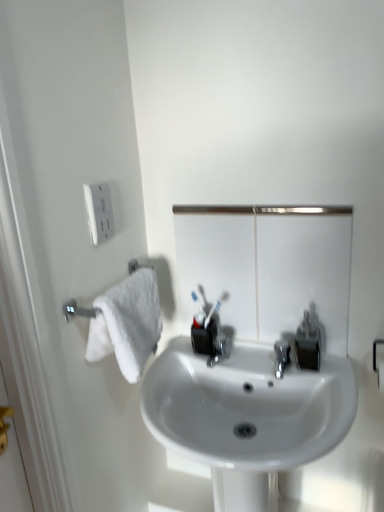
Describe the element at coordinates (247, 416) in the screenshot. I see `white glossy sink at center` at that location.

In order to click on metallic reflective mirror at center in this screenshot , I will do `click(268, 267)`.

Locate an element on the screen. This screenshot has width=384, height=512. white glossy sink at center is located at coordinates (247, 416).

Considering the positions of objects white plastic outlet at upper left and matte black soap dispenser at center right in the image provided, who is more to the left, white plastic outlet at upper left or matte black soap dispenser at center right?

Positioned to the left is white plastic outlet at upper left.

Based on the photo, considering the relative sizes of white plastic outlet at upper left and matte black soap dispenser at center right in the image provided, is white plastic outlet at upper left thinner than matte black soap dispenser at center right?

Correct, the width of white plastic outlet at upper left is less than that of matte black soap dispenser at center right.

From the picture: Is white plastic outlet at upper left behind matte black soap dispenser at center right?

No, it is in front of matte black soap dispenser at center right.

How many degrees apart are the facing directions of white plastic outlet at upper left and matte black soap dispenser at center right?

89.5 degrees separate the facing orientations of white plastic outlet at upper left and matte black soap dispenser at center right.

From the image's perspective, is matte black soap dispenser at center right on white glossy sink at center?

Yes, from the image's perspective, matte black soap dispenser at center right is over white glossy sink at center.

Can you confirm if matte black soap dispenser at center right is smaller than white glossy sink at center?

Yes.

Looking at this image, is white glossy sink at center inside matte black soap dispenser at center right?

No, white glossy sink at center is not inside matte black soap dispenser at center right.

Considering their positions, is matte black soap dispenser at center right located in front of or behind white glossy sink at center?

In the image, matte black soap dispenser at center right appears behind white glossy sink at center.

Who is bigger, metallic reflective mirror at center or matte black soap dispenser at center right?

With larger size is metallic reflective mirror at center.

Looking at this image, which object is further away from the camera, metallic reflective mirror at center or matte black soap dispenser at center right?

matte black soap dispenser at center right is further from the camera.

You are a GUI agent. You are given a task and a screenshot of the screen. Output one action in this format:
    pyautogui.click(x=<x>, y=<y>)
    Task: Click on the plumbing fixture below the metallic reflective mirror at center (from a real-world perspective)
    Image resolution: width=384 pixels, height=512 pixels.
    Given the screenshot: What is the action you would take?
    (308, 345)

How many degrees apart are the facing directions of matte black soap dispenser at center right and white plastic outlet at upper left?

89.5 degrees separate the facing orientations of matte black soap dispenser at center right and white plastic outlet at upper left.

Is matte black soap dispenser at center right to the right of white plastic outlet at upper left from the viewer's perspective?

Yes, matte black soap dispenser at center right is to the right of white plastic outlet at upper left.

Image resolution: width=384 pixels, height=512 pixels. Find the location of `electric outlet on the left of the matte black soap dispenser at center right`. electric outlet on the left of the matte black soap dispenser at center right is located at coordinates (99, 212).

Is matte black soap dispenser at center right facing towards white plastic outlet at upper left?

No, matte black soap dispenser at center right is not oriented towards white plastic outlet at upper left.

Do you think metallic reflective mirror at center is within white plastic outlet at upper left, or outside of it?

metallic reflective mirror at center is outside white plastic outlet at upper left.

What are the coordinates of `electric outlet that is above the metallic reflective mirror at center (from a real-world perspective)` in the screenshot? It's located at (99, 212).

Can you confirm if metallic reflective mirror at center is taller than white plastic outlet at upper left?

Yes.

Does metallic reflective mirror at center appear on the right side of white plastic outlet at upper left?

Correct, you'll find metallic reflective mirror at center to the right of white plastic outlet at upper left.

Image resolution: width=384 pixels, height=512 pixels. What are the coordinates of `sink that appears below the metallic reflective mirror at center (from the image's perspective)` in the screenshot? It's located at (247, 416).

Can you confirm if metallic reflective mirror at center is shorter than white glossy sink at center?

Indeed, metallic reflective mirror at center has a lesser height compared to white glossy sink at center.

Consider the image. Is metallic reflective mirror at center with white glossy sink at center?

No.

Is metallic reflective mirror at center positioned with its back to white glossy sink at center?

No, white glossy sink at center is not at the back of metallic reflective mirror at center.

How different are the orientations of white plastic outlet at upper left and metallic reflective mirror at center in degrees?

The facing directions of white plastic outlet at upper left and metallic reflective mirror at center are 89.5 degrees apart.

Considering the sizes of objects white plastic outlet at upper left and metallic reflective mirror at center in the image provided, who is thinner, white plastic outlet at upper left or metallic reflective mirror at center?

Thinner between the two is white plastic outlet at upper left.

Considering the positions of objects white plastic outlet at upper left and metallic reflective mirror at center in the image provided, who is more to the left, white plastic outlet at upper left or metallic reflective mirror at center?

white plastic outlet at upper left is more to the left.

The width and height of the screenshot is (384, 512). I want to click on plumbing fixture that is below the white plastic outlet at upper left (from the image's perspective), so click(x=308, y=345).

What are the coordinates of `sink to the left of matte black soap dispenser at center right` in the screenshot? It's located at (247, 416).

Based on their spatial positions, is white glossy sink at center or white plastic outlet at upper left further from matte black soap dispenser at center right?

Among the two, white plastic outlet at upper left is located further to matte black soap dispenser at center right.

From the image, which object appears to be nearer to metallic reflective mirror at center, white glossy sink at center or white plastic outlet at upper left?

white glossy sink at center is positioned closer to the anchor metallic reflective mirror at center.

In the scene shown: Based on their spatial positions, is white plastic outlet at upper left or white glossy sink at center further from metallic reflective mirror at center?

white plastic outlet at upper left.

Based on their spatial positions, is white glossy sink at center or metallic reflective mirror at center closer to white plastic outlet at upper left?

Based on the image, metallic reflective mirror at center appears to be nearer to white plastic outlet at upper left.

In the scene shown: Estimate the real-world distances between objects in this image. Which object is further from matte black soap dispenser at center right, white glossy sink at center or metallic reflective mirror at center?

Based on the image, white glossy sink at center appears to be further to matte black soap dispenser at center right.

Considering their positions, is matte black soap dispenser at center right positioned closer to white glossy sink at center than metallic reflective mirror at center?

matte black soap dispenser at center right is closer to white glossy sink at center.

Considering their positions, is metallic reflective mirror at center positioned closer to white plastic outlet at upper left than white glossy sink at center?

metallic reflective mirror at center is positioned closer to the anchor white plastic outlet at upper left.

Considering their positions, is white plastic outlet at upper left positioned further to matte black soap dispenser at center right than metallic reflective mirror at center?

Based on the image, white plastic outlet at upper left appears to be further to matte black soap dispenser at center right.

Locate an element on the screen. mirror between white plastic outlet at upper left and white glossy sink at center vertically is located at coordinates (268, 267).

This screenshot has height=512, width=384. Find the location of `plumbing fixture that lies between metallic reflective mirror at center and white glossy sink at center from top to bottom`. plumbing fixture that lies between metallic reflective mirror at center and white glossy sink at center from top to bottom is located at coordinates (308, 345).

You are a GUI agent. You are given a task and a screenshot of the screen. Output one action in this format:
    pyautogui.click(x=<x>, y=<y>)
    Task: Click on the plumbing fixture between white plastic outlet at upper left and white glossy sink at center in the up-down direction
    
    Given the screenshot: What is the action you would take?
    pyautogui.click(x=308, y=345)

Locate an element on the screen. mirror between white plastic outlet at upper left and matte black soap dispenser at center right is located at coordinates (268, 267).